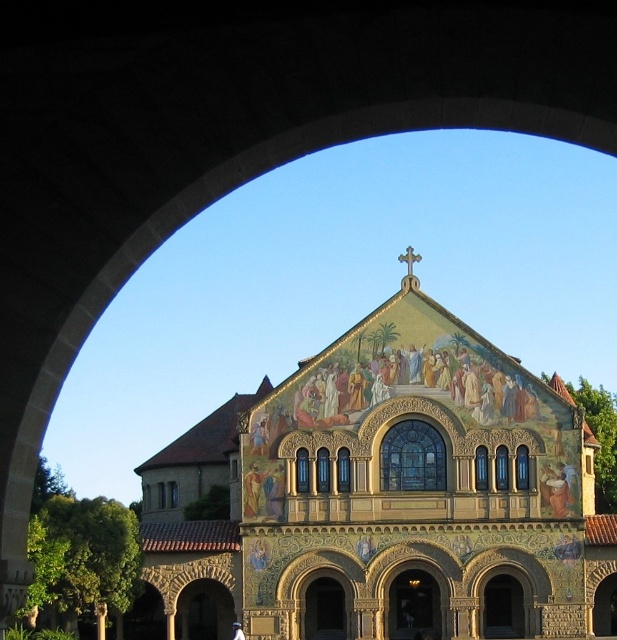
Question: In this image, where is golden mosaic church at center located relative to white stone pillar at lower left?

Choices:
 (A) above
 (B) below

Answer: (A)

Question: Does golden mosaic church at center have a smaller size compared to white stone pillar at lower left?

Choices:
 (A) yes
 (B) no

Answer: (B)

Question: Does golden mosaic church at center have a lesser width compared to white stone pillar at lower left?

Choices:
 (A) no
 (B) yes

Answer: (A)

Question: Which point is farther to the camera?

Choices:
 (A) white stone pillar at lower left
 (B) golden mosaic church at center

Answer: (A)